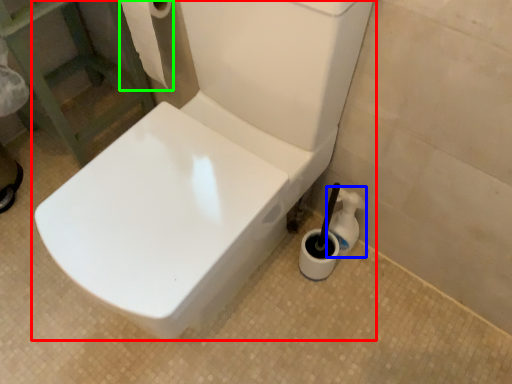
Question: Which object is the farthest from toilet (highlighted by a red box)? Choose among these: cleaning product (highlighted by a blue box) or toilet paper (highlighted by a green box).

Choices:
 (A) cleaning product
 (B) toilet paper

Answer: (B)